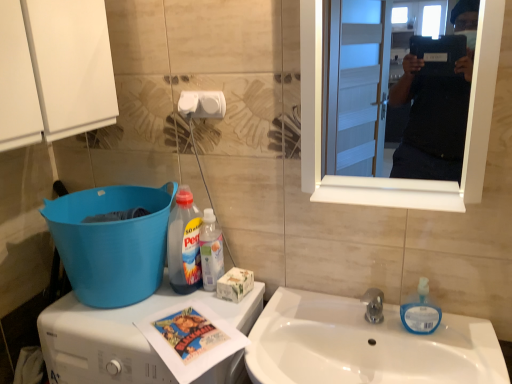
The image size is (512, 384). What are the coordinates of `vacant area that is in front of blue translucent soap dispenser at sink right` in the screenshot? It's located at (456, 354).